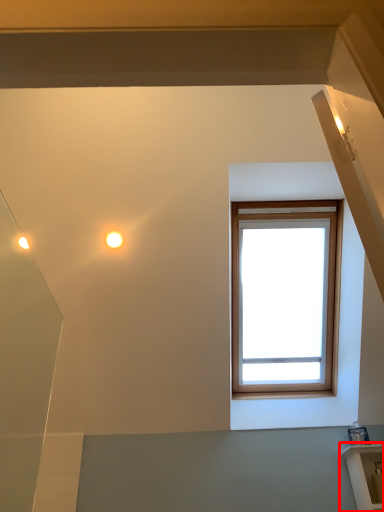
Question: From the image's perspective, where is shelf (annotated by the red box) located relative to droplight?

Choices:
 (A) below
 (B) above

Answer: (A)